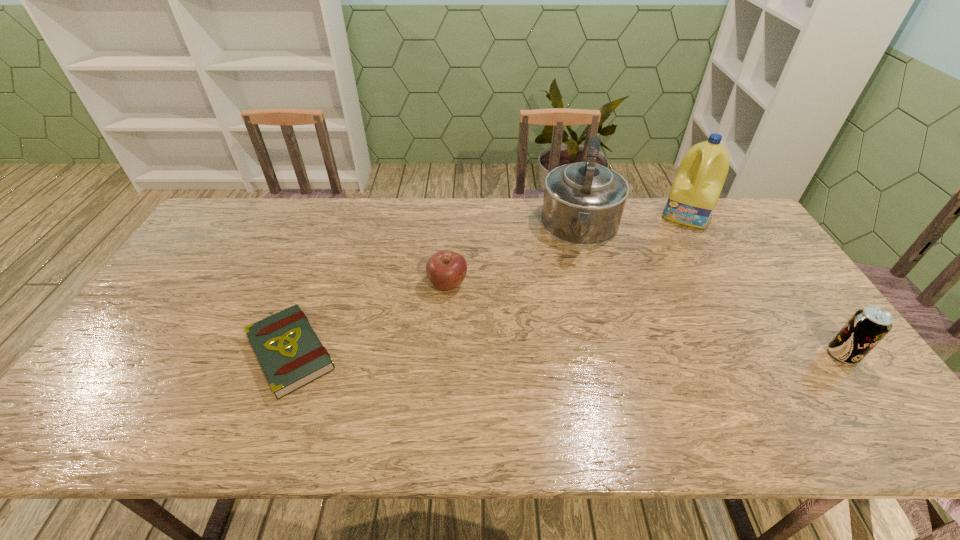
Image resolution: width=960 pixels, height=540 pixels. Find the location of `blank region between the kettle and the fourth object from left to right`. blank region between the kettle and the fourth object from left to right is located at coordinates (634, 221).

You are a GUI agent. You are given a task and a screenshot of the screen. Output one action in this format:
    pyautogui.click(x=<x>, y=<y>)
    Task: Click on the vacant region between the leftmost object and the kettle
    This screenshot has width=960, height=540.
    Given the screenshot: What is the action you would take?
    pyautogui.click(x=436, y=291)

At what (x,y) coordinates should I click in order to perform the action: click on free space between the third nearest object and the detergent. Please return your answer as a coordinate pair (x, y). The width and height of the screenshot is (960, 540). Looking at the image, I should click on (567, 249).

This screenshot has width=960, height=540. Find the location of `free point between the apple and the leftmost object`. free point between the apple and the leftmost object is located at coordinates (369, 318).

I want to click on free spot between the apple and the soda can, so click(645, 319).

Find the location of `empty location between the leftmost object and the third tallest object`. empty location between the leftmost object and the third tallest object is located at coordinates (566, 354).

The height and width of the screenshot is (540, 960). Identify the location of vacant area between the second object from left to right and the shortest object. (369, 318).

Image resolution: width=960 pixels, height=540 pixels. In order to click on empty space between the apple and the third object from left to right in this screenshot , I will do `click(515, 256)`.

Locate an element on the screen. The width and height of the screenshot is (960, 540). vacant region between the detergent and the kettle is located at coordinates (634, 221).

I want to click on object that is the fourth closest to the leftmost object, so click(867, 327).